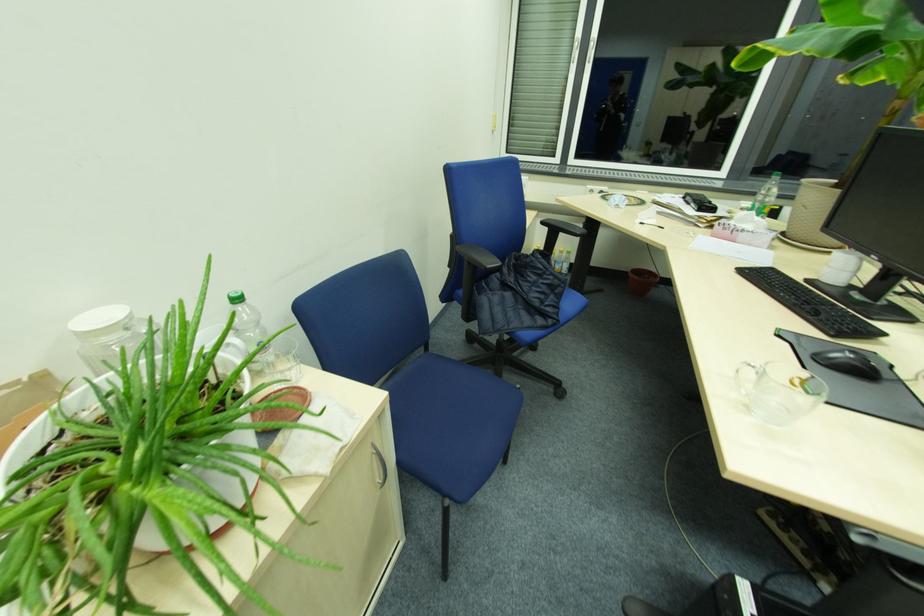
Where would you rest the black chair armrest? Please return your answer as a coordinate pair (x, y).

(478, 257)